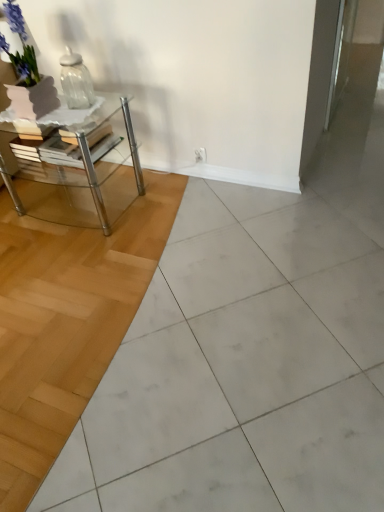
The width and height of the screenshot is (384, 512). In order to click on vacant area situated below clear glass table at left (from a real-world perspective) in this screenshot , I will do `click(72, 205)`.